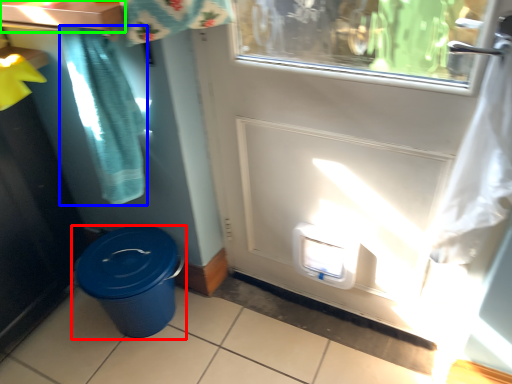
Question: Considering the real-world distances, which object is farthest from waste container (highlighted by a red box)? shower curtain (highlighted by a blue box) or counter top (highlighted by a green box)?

Choices:
 (A) shower curtain
 (B) counter top

Answer: (B)